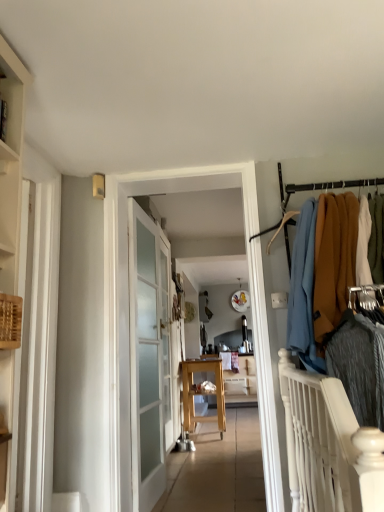
Question: From the image's perspective, is wooden table at center beneath wooden table at center?

Choices:
 (A) no
 (B) yes

Answer: (A)

Question: Would you say wooden table at center is a long distance from wooden table at center?

Choices:
 (A) yes
 (B) no

Answer: (B)

Question: Would you say wooden table at center is part of wooden table at center's contents?

Choices:
 (A) yes
 (B) no

Answer: (B)

Question: Considering the relative sizes of wooden table at center and wooden table at center in the image provided, is wooden table at center smaller than wooden table at center?

Choices:
 (A) yes
 (B) no

Answer: (A)

Question: Is wooden table at center turned away from wooden table at center?

Choices:
 (A) yes
 (B) no

Answer: (B)

Question: Can you confirm if wooden table at center is wider than wooden table at center?

Choices:
 (A) no
 (B) yes

Answer: (A)

Question: From the image's perspective, would you say wooden table at center is positioned over wooden shelf at left?

Choices:
 (A) yes
 (B) no

Answer: (B)

Question: From the image's perspective, would you say wooden table at center is shown under wooden shelf at left?

Choices:
 (A) yes
 (B) no

Answer: (A)

Question: Does wooden table at center appear on the left side of wooden shelf at left?

Choices:
 (A) yes
 (B) no

Answer: (B)

Question: From a real-world perspective, is wooden table at center under wooden shelf at left?

Choices:
 (A) yes
 (B) no

Answer: (A)

Question: Is wooden table at center closer to the viewer compared to wooden shelf at left?

Choices:
 (A) yes
 (B) no

Answer: (B)

Question: Is wooden table at center facing away from wooden shelf at left?

Choices:
 (A) yes
 (B) no

Answer: (B)

Question: Considering the relative positions of wooden table at center and wooden table at center in the image provided, is wooden table at center behind wooden table at center?

Choices:
 (A) no
 (B) yes

Answer: (B)